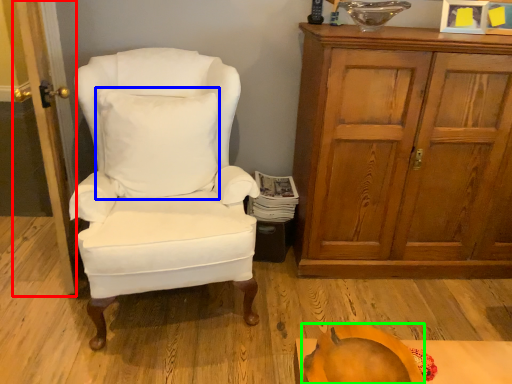
Question: Estimate the real-world distances between objects in this image. Which object is closer to door (highlighted by a red box), pillow (highlighted by a blue box) or pumpkin (highlighted by a green box)?

Choices:
 (A) pillow
 (B) pumpkin

Answer: (A)